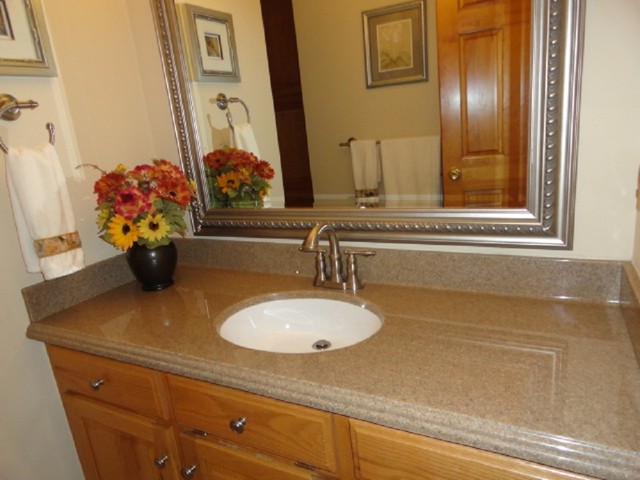
Identify the location of bathroom walls. The height and width of the screenshot is (480, 640). (35, 400), (616, 96), (129, 98).